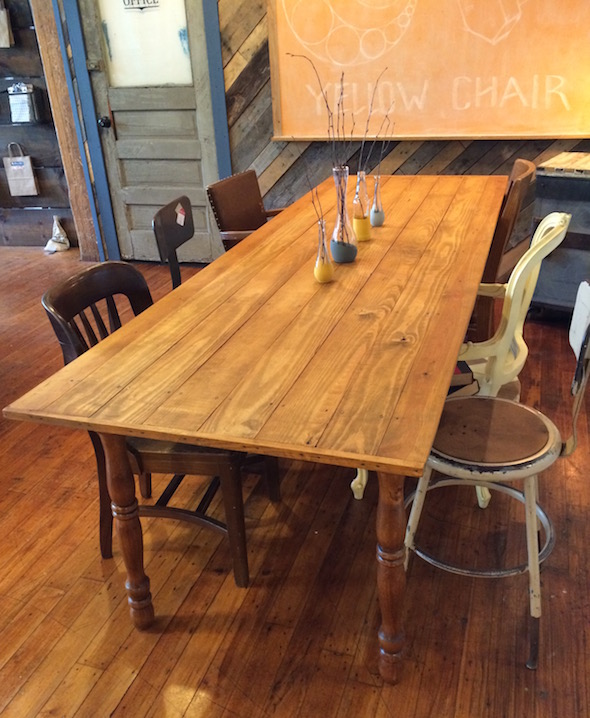
This screenshot has height=718, width=590. What are the coordinates of `3 visible bags hanging on wall` in the screenshot? It's located at pos(11,39), pos(19,95), pos(25,186).